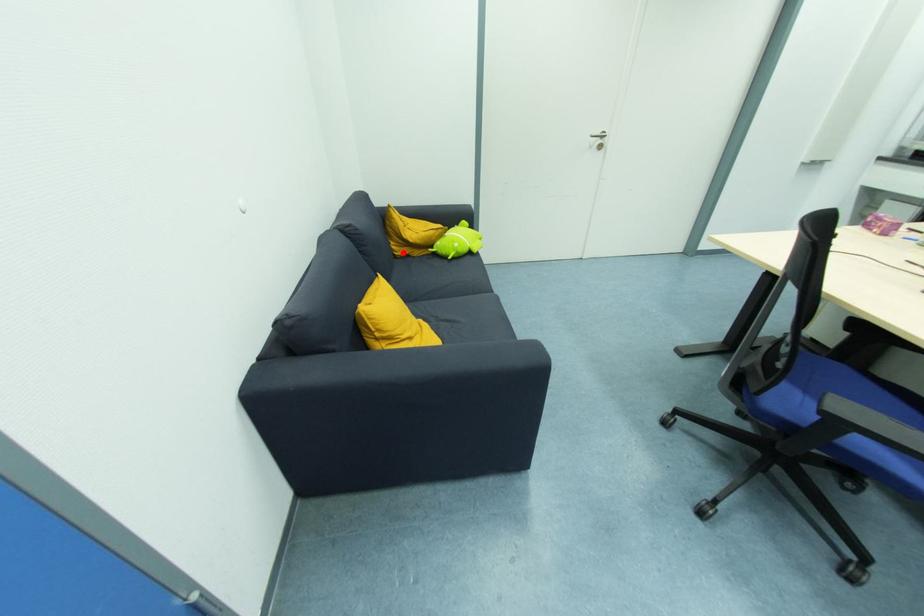
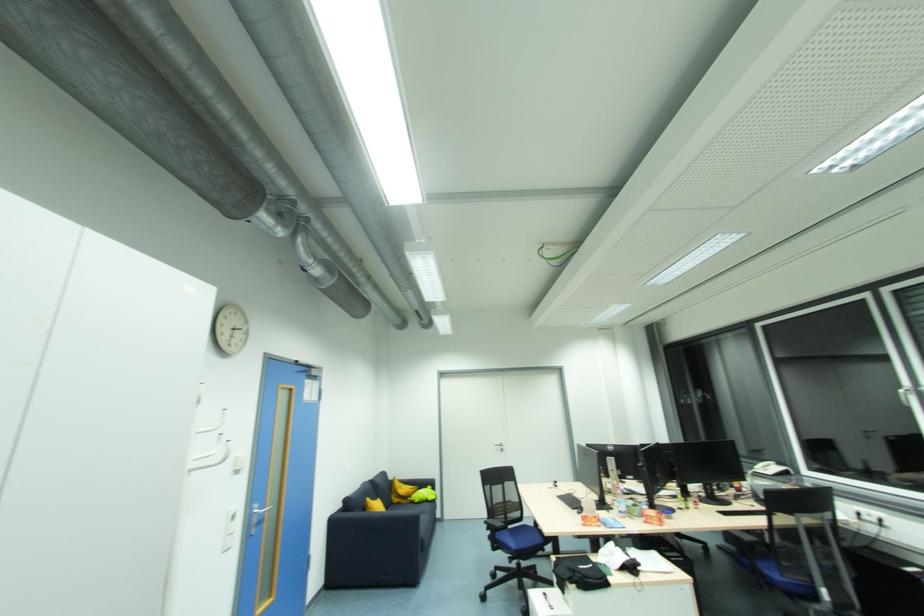
In the second image, find the point that corresponds to the highlighted location in the first image.

(397, 501)